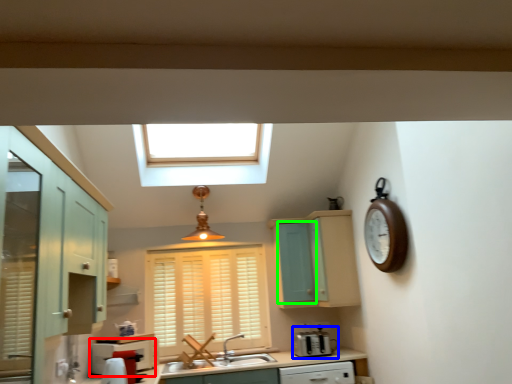
Question: Based on their relative distances, which object is farther from oven (highlighted by a red box)? Choose from appliance (highlighted by a blue box) and screen door (highlighted by a green box).

Choices:
 (A) appliance
 (B) screen door

Answer: (B)